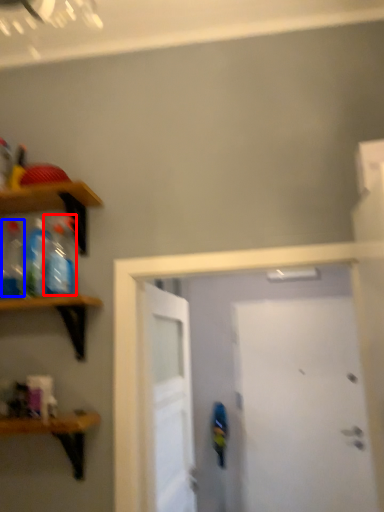
Question: Which of the following is the closest to the observer, bottle (highlighted by a red box) or bottle (highlighted by a blue box)?

Choices:
 (A) bottle
 (B) bottle

Answer: (A)